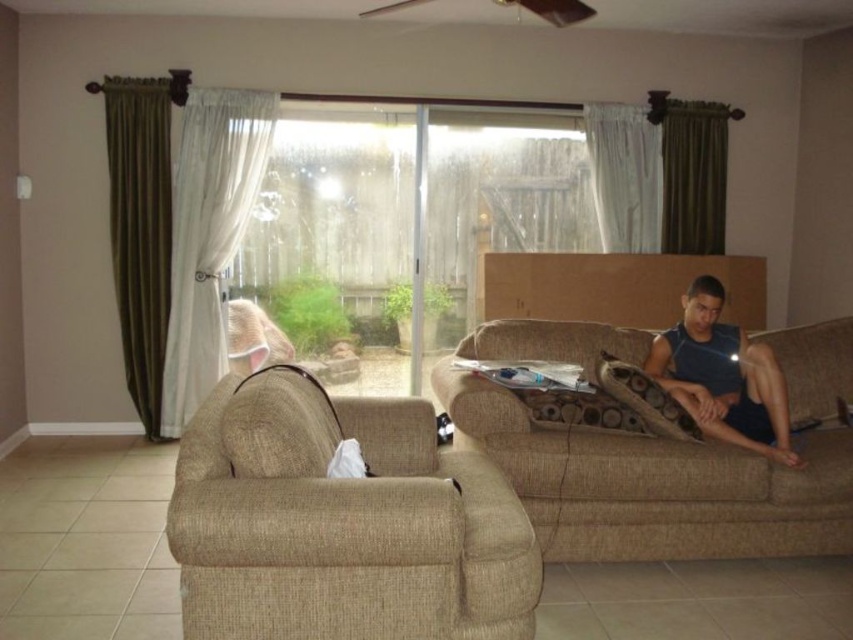
You are planning to rearrange the living room and want to place a new side table next to the beige fabric couch at right and the dark blue tank top at right. Which object requires a larger surface area for placement?

The beige fabric couch at right requires a larger surface area for placement since it is bigger than the dark blue tank top at right.

You are standing in the living room and want to move from the sofa to the sliding glass door. There are two points marked on the floor, point A at coordinates point(740, 531) and point B at coordinates point(788, 451). Which point is closer to the sliding glass door?

Point A at coordinates point(740, 531) is closer to the sliding glass door because it is in front of point B at coordinates point(788, 451).